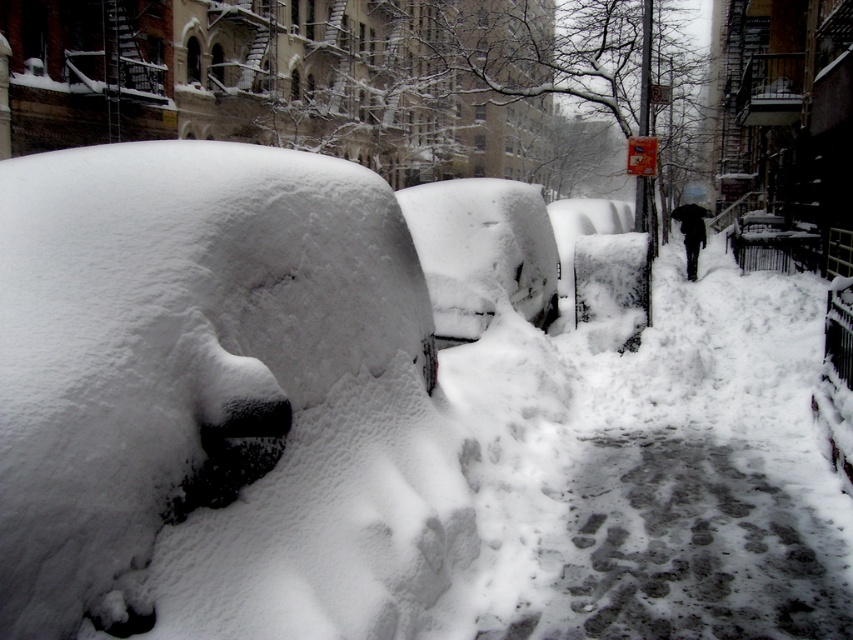
Consider the image. Is the position of gray/rough pavement at lower center more distant than that of white fluffy snow at center?

No, it is in front of white fluffy snow at center.

Measure the distance between gray/rough pavement at lower center and camera.

They are 3.22 meters apart.

Locate an element on the screen. gray/rough pavement at lower center is located at coordinates (689, 547).